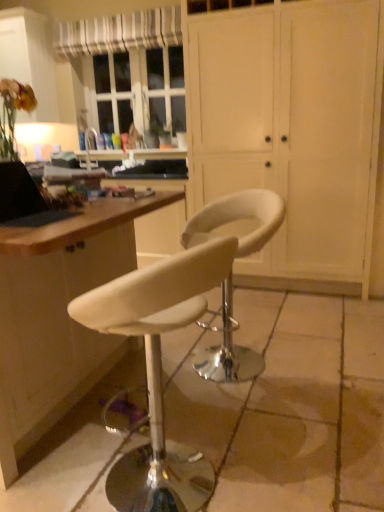
What is the approximate width of white leather stool at center?

It is 5.01 feet.

What do you see at coordinates (292, 128) in the screenshot? I see `white matte cabinet at center` at bounding box center [292, 128].

The image size is (384, 512). In order to click on white leather stool at center, which appears as the 2th chair when viewed from the back in this screenshot , I will do click(158, 370).

Considering the positions of objects white matte cabinet at center and black matte laptop at left in the image provided, who is more to the right, white matte cabinet at center or black matte laptop at left?

white matte cabinet at center.

This screenshot has height=512, width=384. What are the coordinates of `screen door above the black matte laptop at left (from a real-world perspective)` in the screenshot? It's located at (292, 128).

From a real-world perspective, between white matte cabinet at center and black matte laptop at left, who is vertically lower?

From a 3D spatial view, black matte laptop at left is below.

Is white matte cabinet at center smaller than black matte laptop at left?

No, white matte cabinet at center is not smaller than black matte laptop at left.

Which object is wider, black matte laptop at left or white leather stool at center?

white leather stool at center is wider.

Relative to white leather stool at center, is black matte laptop at left in front or behind?

In the image, black matte laptop at left appears behind white leather stool at center.

Which is behind, point (6, 206) or point (241, 336)?

The point (241, 336) is farther from the camera.

Considering the relative sizes of black matte laptop at left and white leather stool at center in the image provided, is black matte laptop at left bigger than white leather stool at center?

No.

Consider the image. Is white matte cabinet at center turned away from white leather stool at center, which appears as the first chair when viewed from the back?

No, white leather stool at center, which appears as the first chair when viewed from the back, is not at the back of white matte cabinet at center.

Is white matte cabinet at center next to white leather stool at center, placed as the second chair when sorted from front to back, and touching it?

No, white matte cabinet at center is not with white leather stool at center, placed as the second chair when sorted from front to back.

Based on the photo, is the depth of white matte cabinet at center greater than that of white leather stool at center, placed as the second chair when sorted from front to back?

Yes, white matte cabinet at center is further from the viewer.

Does matte white cabinet at upper left have a smaller size compared to white leather stool at center?

No, matte white cabinet at upper left is not smaller than white leather stool at center.

Is point (31, 51) farther from camera compared to point (275, 431)?

Yes, it is.

Considering the relative sizes of matte white cabinet at upper left and white leather stool at center in the image provided, is matte white cabinet at upper left wider than white leather stool at center?

Incorrect, the width of matte white cabinet at upper left does not surpass that of white leather stool at center.

Between matte white cabinet at upper left and white leather stool at center, which appears as the 2th chair when viewed from the back, which one has less height?

white leather stool at center, which appears as the 2th chair when viewed from the back.

Measure the distance from matte white cabinet at upper left to white leather stool at center, which appears as the 2th chair when viewed from the back.

matte white cabinet at upper left and white leather stool at center, which appears as the 2th chair when viewed from the back, are 3.10 meters apart from each other.

Between matte white cabinet at upper left and white leather stool at center, placed as the 1th chair when sorted from front to back, which one appears on the right side from the viewer's perspective?

From the viewer's perspective, white leather stool at center, placed as the 1th chair when sorted from front to back, appears more on the right side.

Between white striped fabric at upper left and matte white cabinet at upper left, which one appears on the right side from the viewer's perspective?

white striped fabric at upper left.

From a real-world perspective, which object rests below the other?

matte white cabinet at upper left is physically lower.

From the image's perspective, between white striped fabric at upper left and matte white cabinet at upper left, who is located below?

matte white cabinet at upper left.

Can you confirm if white striped fabric at upper left is smaller than matte white cabinet at upper left?

Correct, white striped fabric at upper left occupies less space than matte white cabinet at upper left.

Can you tell me how much white matte cabinet at center and white leather stool at center, placed as the 1th chair when sorted from front to back, differ in facing direction?

The facing directions of white matte cabinet at center and white leather stool at center, placed as the 1th chair when sorted from front to back, are 95.8 degrees apart.

Is white matte cabinet at center turned away from white leather stool at center, placed as the 1th chair when sorted from front to back?

white matte cabinet at center does not have its back to white leather stool at center, placed as the 1th chair when sorted from front to back.

Does point (371, 124) come closer to viewer compared to point (173, 313)?

No.

From a real-world perspective, is white matte cabinet at center located beneath white leather stool at center, placed as the 1th chair when sorted from front to back?

No, from a real-world perspective, white matte cabinet at center is not below white leather stool at center, placed as the 1th chair when sorted from front to back.

You are a GUI agent. You are given a task and a screenshot of the screen. Output one action in this format:
    pyautogui.click(x=<x>, y=<y>)
    Task: Click on the kitchen appliance lying on the left of white matte cabinet at center
    This screenshot has height=512, width=384.
    Given the screenshot: What is the action you would take?
    pyautogui.click(x=24, y=199)

Locate an element on the screen. kitchen appliance above the white leather stool at center (from the image's perspective) is located at coordinates coord(24,199).

From the image, which object appears to be nearer to wooden desk at lower left, white striped fabric at upper left or white leather stool at center, placed as the 1th chair when sorted from front to back?

The object closer to wooden desk at lower left is white leather stool at center, placed as the 1th chair when sorted from front to back.

From the image, which object appears to be nearer to black matte laptop at left, matte white cabinet at upper left or white leather stool at center, placed as the second chair when sorted from front to back?

white leather stool at center, placed as the second chair when sorted from front to back, is positioned closer to the anchor black matte laptop at left.

Based on their spatial positions, is white leather stool at center, placed as the 1th chair when sorted from front to back, or white striped fabric at upper left further from wooden desk at lower left?

Based on the image, white striped fabric at upper left appears to be further to wooden desk at lower left.

Looking at the image, which one is located further to white striped fabric at upper left, white leather stool at center, placed as the 1th chair when sorted from front to back, or white matte cabinet at center?

Among the two, white leather stool at center, placed as the 1th chair when sorted from front to back, is located further to white striped fabric at upper left.

In the scene shown: Based on their spatial positions, is white matte cabinet at center or black matte laptop at left further from white leather stool at center, which appears as the first chair when viewed from the back?

white matte cabinet at center.

Looking at the image, which one is located further to wooden desk at lower left, white leather stool at center, which appears as the first chair when viewed from the back, or white leather stool at center, placed as the 1th chair when sorted from front to back?

white leather stool at center, which appears as the first chair when viewed from the back, is further to wooden desk at lower left.

Looking at the image, which one is located further to white leather stool at center, which appears as the first chair when viewed from the back, black matte laptop at left or white leather stool at center?

black matte laptop at left lies further to white leather stool at center, which appears as the first chair when viewed from the back, than the other object.

Which object lies nearer to the anchor point white leather stool at center, which appears as the first chair when viewed from the back, white leather stool at center, placed as the 1th chair when sorted from front to back, or white striped fabric at upper left?

white leather stool at center, placed as the 1th chair when sorted from front to back.

This screenshot has width=384, height=512. Identify the location of kitchen appliance located between white leather stool at center and white matte cabinet at center in the depth direction. (24, 199).

This screenshot has width=384, height=512. I want to click on kitchen appliance between white leather stool at center and white striped fabric at upper left from front to back, so click(24, 199).

Where is `kitchen appliance positioned between white leather stool at center, placed as the 1th chair when sorted from front to back, and matte white cabinet at upper left from near to far`? kitchen appliance positioned between white leather stool at center, placed as the 1th chair when sorted from front to back, and matte white cabinet at upper left from near to far is located at coordinates (24, 199).

Locate an element on the screen. Image resolution: width=384 pixels, height=512 pixels. kitchen appliance between wooden desk at lower left and white leather stool at center, which appears as the 2th chair when viewed from the back, from left to right is located at coordinates [24, 199].